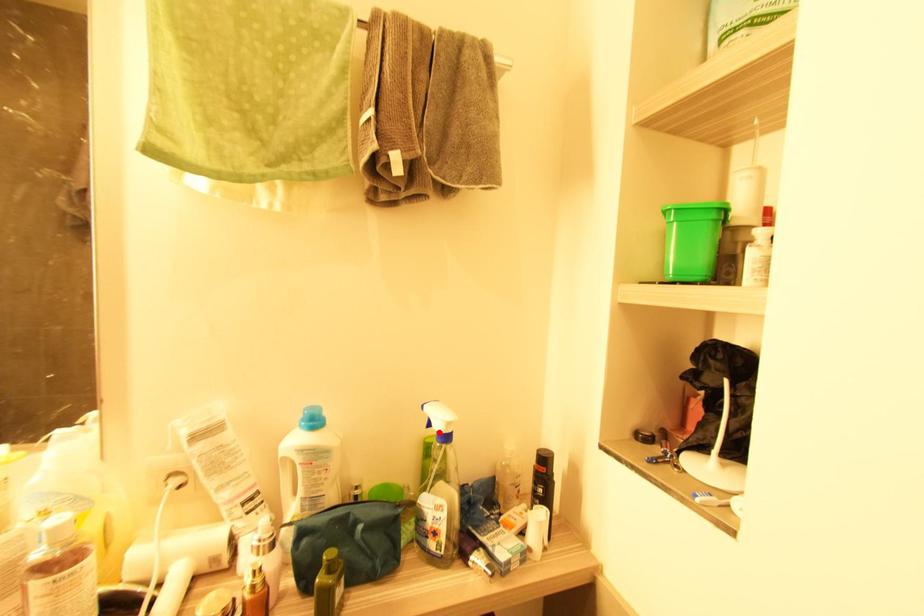
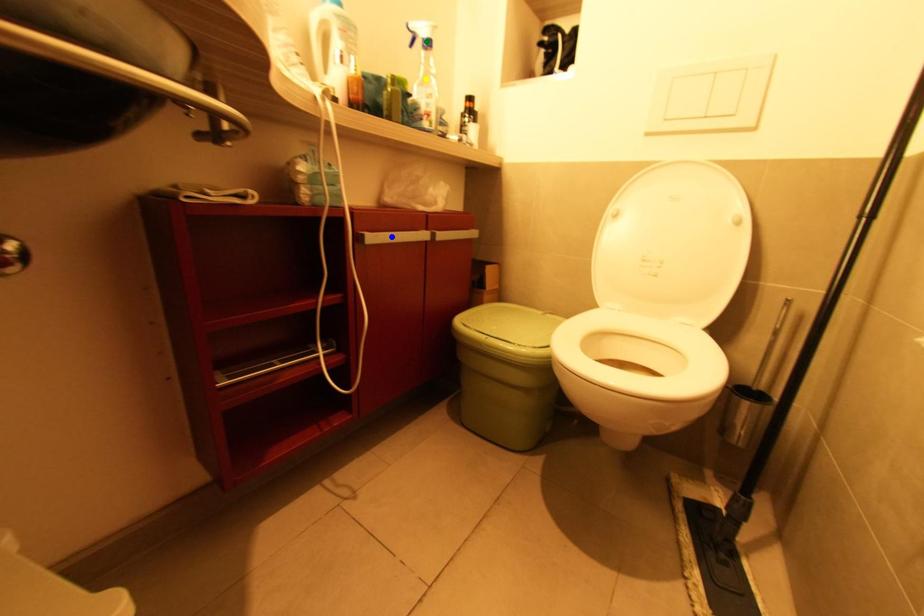
Question: I am providing you with two images of the same scene from different viewpoints. A red point is marked on the first image. You are given multiple points on the second image. Which mark in image 2 goes with the point in image 1?

Choices:
 (A) blue point
 (B) green point
 (C) yellow point

Answer: (B)